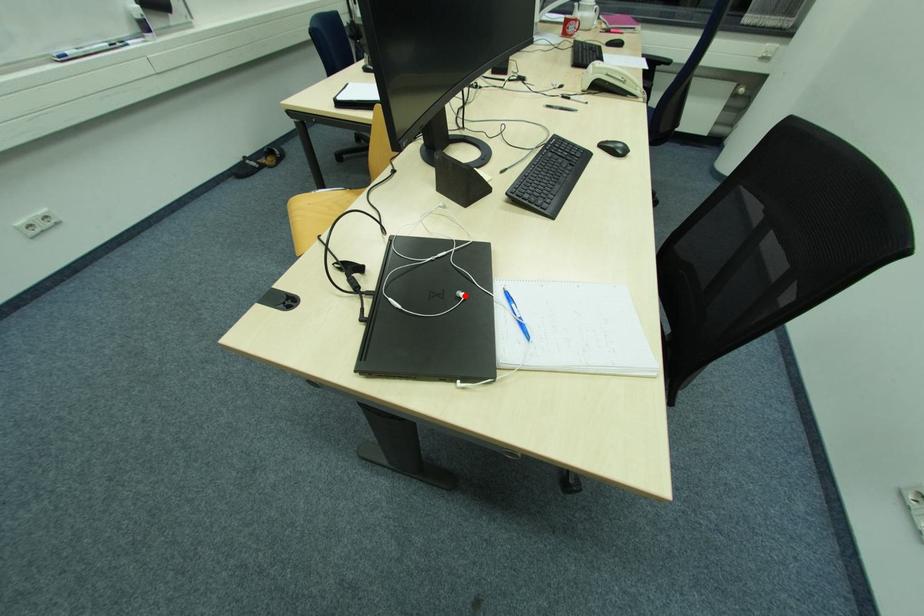
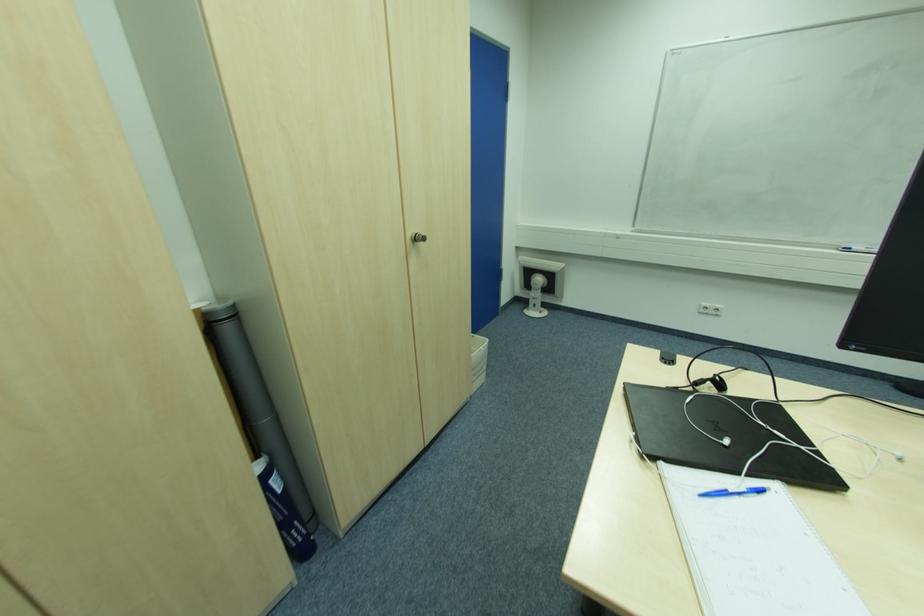
Locate, in the second image, the point that corresponds to the highlighted location in the first image.

(728, 443)